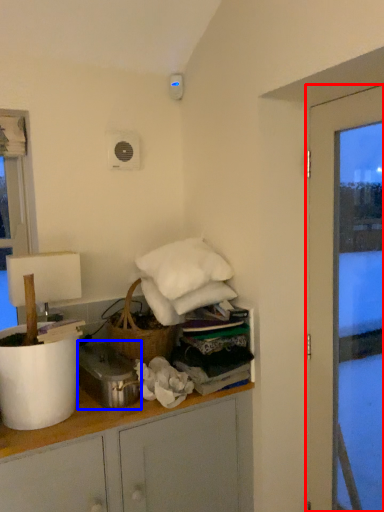
Question: Which of the following is the farthest to the observer, door (highlighted by a red box) or appliance (highlighted by a blue box)?

Choices:
 (A) door
 (B) appliance

Answer: (B)